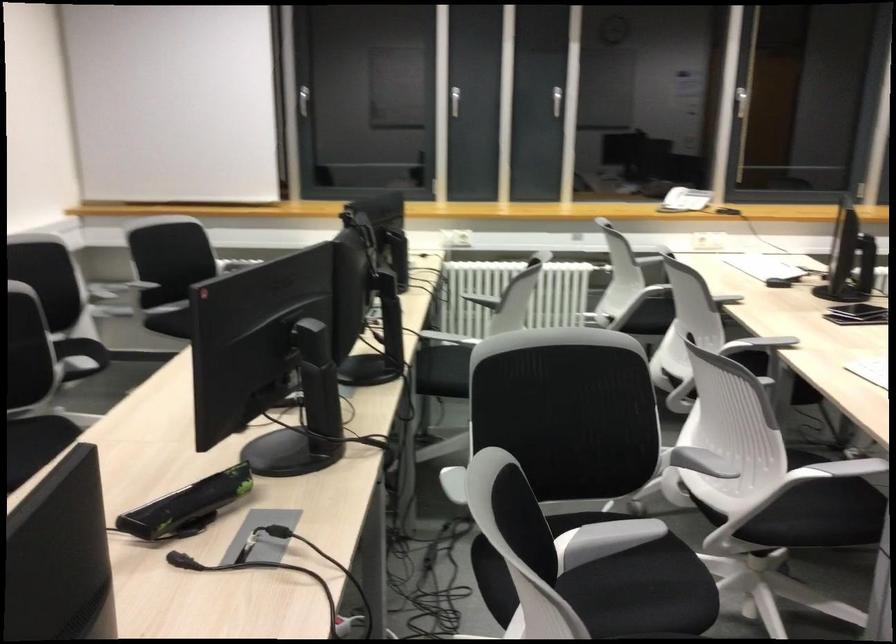
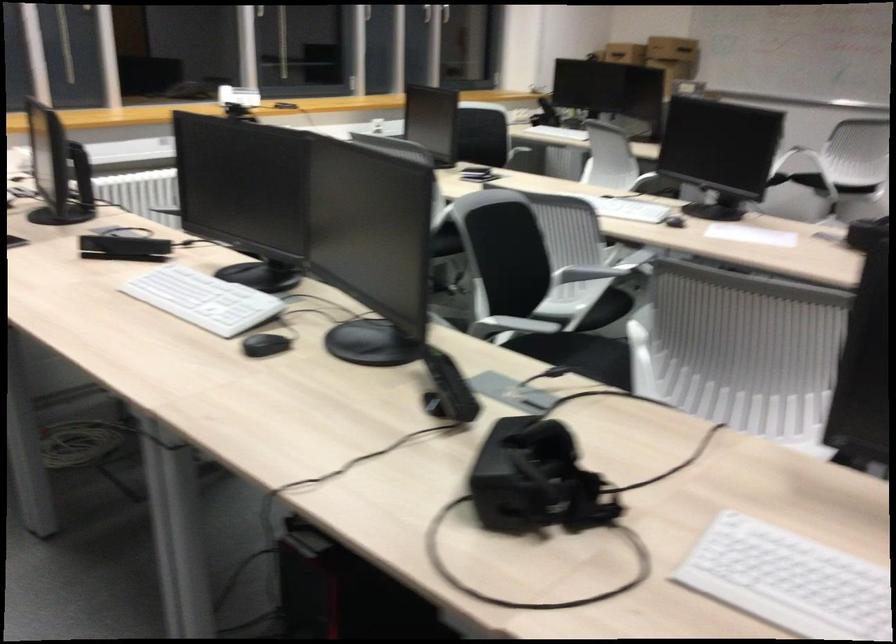
Locate, in the second image, the point that corresponds to the point at 599,412 in the first image.

(510, 257)